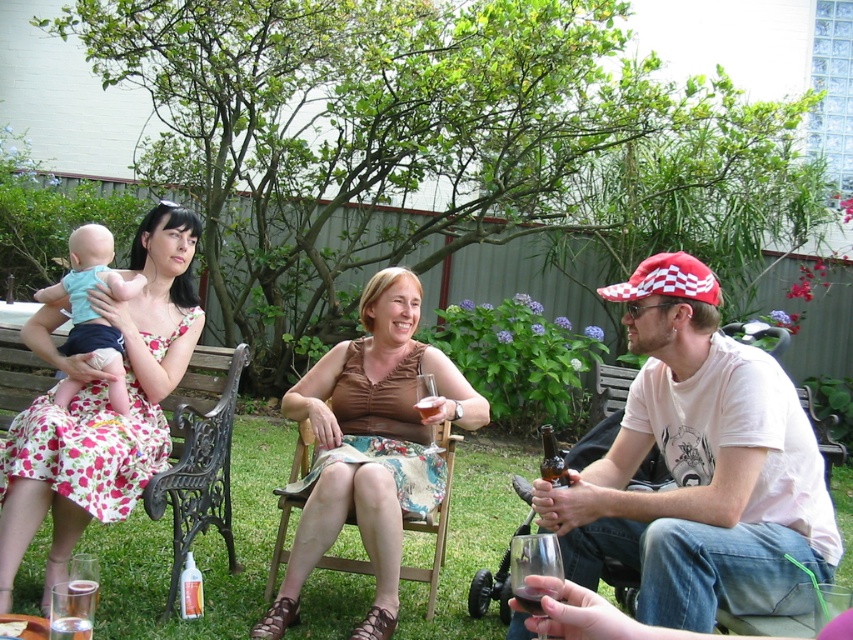
Question: Estimate the real-world distances between objects in this image. Which object is farther from the matte brown dress at center?

Choices:
 (A) matte blue fabric baby at left
 (B) translucent glass wine at lower center
 (C) clear glass at lower left

Answer: (B)

Question: Which of the following is the farthest from the observer?

Choices:
 (A) white cotton t-shirt at center
 (B) translucent glass wine at lower center
 (C) clear glass at lower left
 (D) translucent glass beer at center

Answer: (D)

Question: Which point is closer to the camera taking this photo?

Choices:
 (A) pyautogui.click(x=535, y=605)
 (B) pyautogui.click(x=57, y=397)
 (C) pyautogui.click(x=164, y=451)

Answer: (A)

Question: Where is brown satin blouse at center located in relation to matte blue fabric baby at left in the image?

Choices:
 (A) right
 (B) left

Answer: (A)

Question: Can you confirm if matte brown dress at center is wider than translucent glass beer at center?

Choices:
 (A) yes
 (B) no

Answer: (A)

Question: Does white cotton t-shirt at center appear over translucent glass beer at center?

Choices:
 (A) yes
 (B) no

Answer: (B)